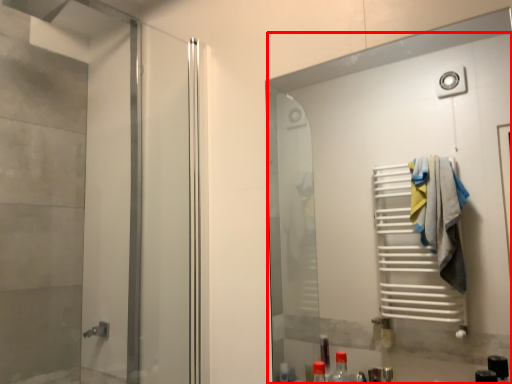
Question: In this image, where is door (annotated by the red box) located relative to elevator?

Choices:
 (A) left
 (B) right

Answer: (B)